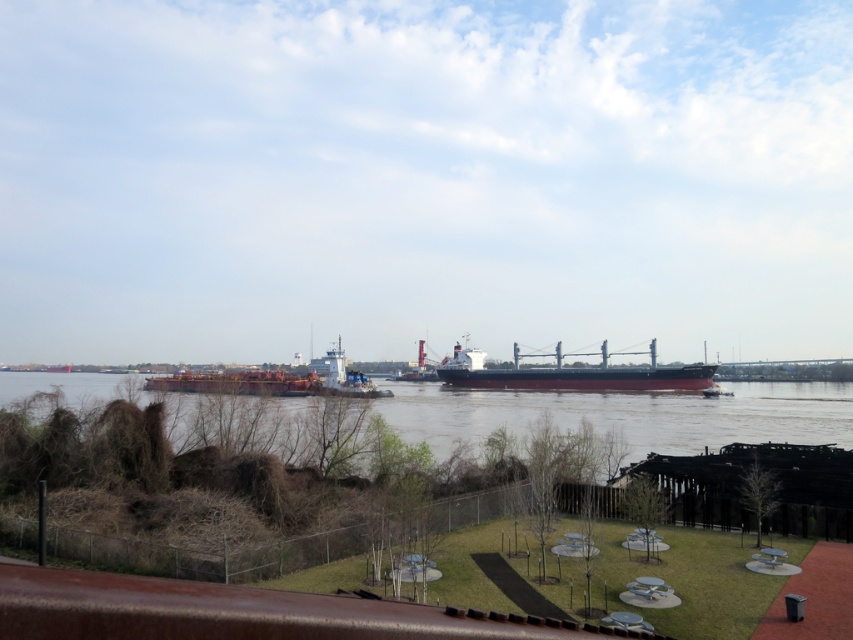
Question: Considering the real-world distances, which object is farthest from the dark blue matte cargo ship at center?

Choices:
 (A) brown matte river at center
 (B) rustic metal barge at center

Answer: (B)

Question: Can you confirm if dark blue matte cargo ship at center is bigger than rustic metal barge at center?

Choices:
 (A) no
 (B) yes

Answer: (A)

Question: Can you confirm if dark blue matte cargo ship at center is positioned to the left of rustic metal barge at center?

Choices:
 (A) no
 (B) yes

Answer: (A)

Question: Which object appears closest to the camera in this image?

Choices:
 (A) rustic metal barge at center
 (B) brown matte river at center

Answer: (B)

Question: Which point appears closest to the camera in this image?

Choices:
 (A) (561, 388)
 (B) (375, 385)

Answer: (A)

Question: Can you confirm if brown matte river at center is positioned to the left of rustic metal barge at center?

Choices:
 (A) yes
 (B) no

Answer: (B)